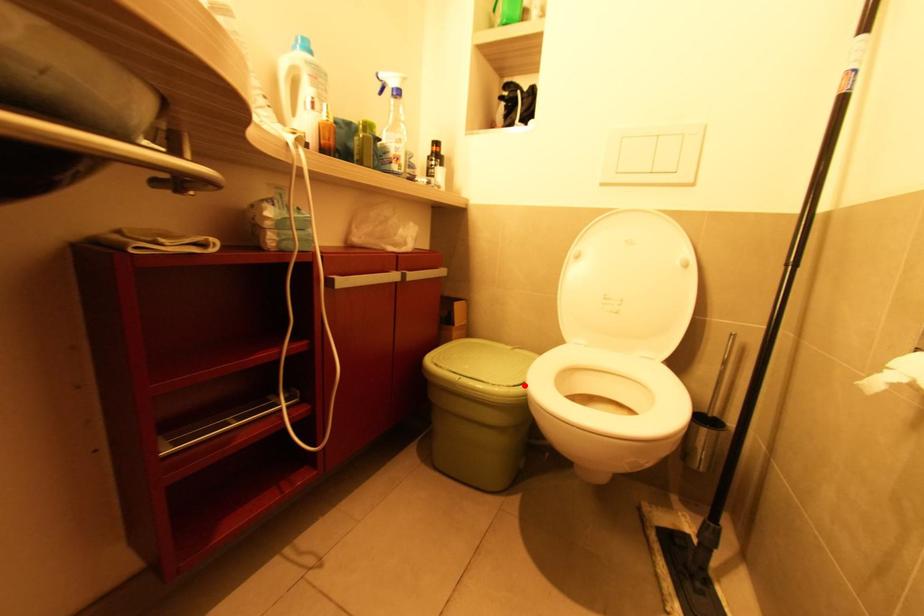
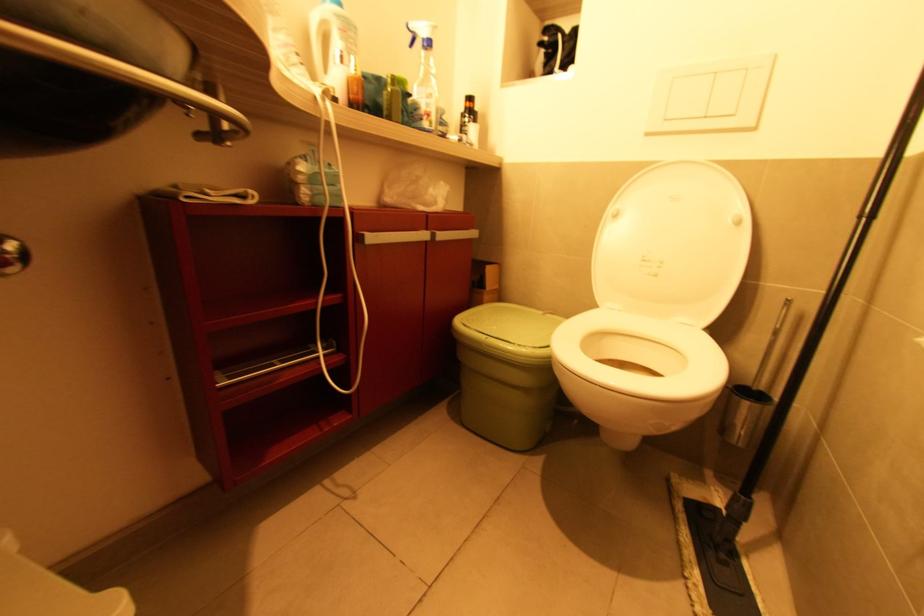
In the second image, find the point that corresponds to the highlighted location in the first image.

(551, 347)